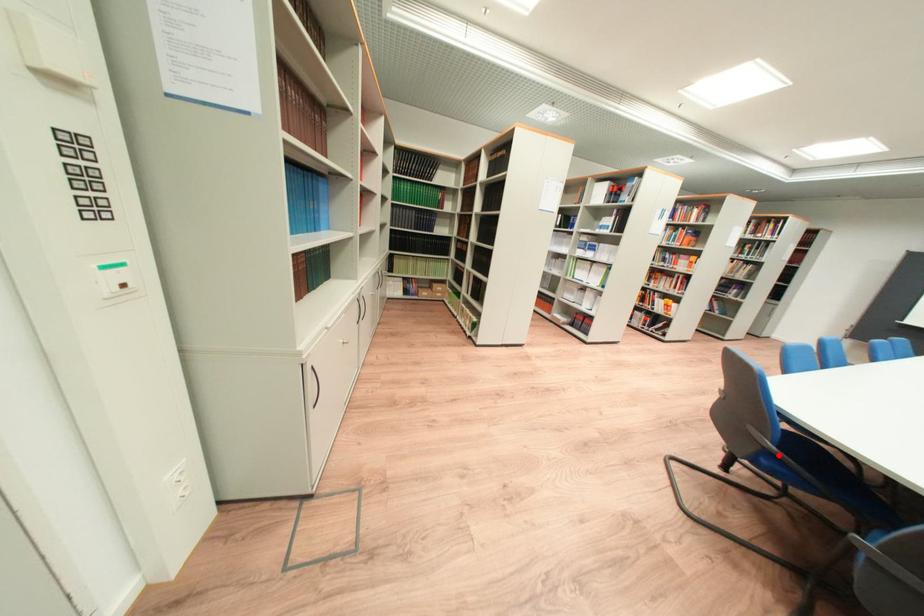
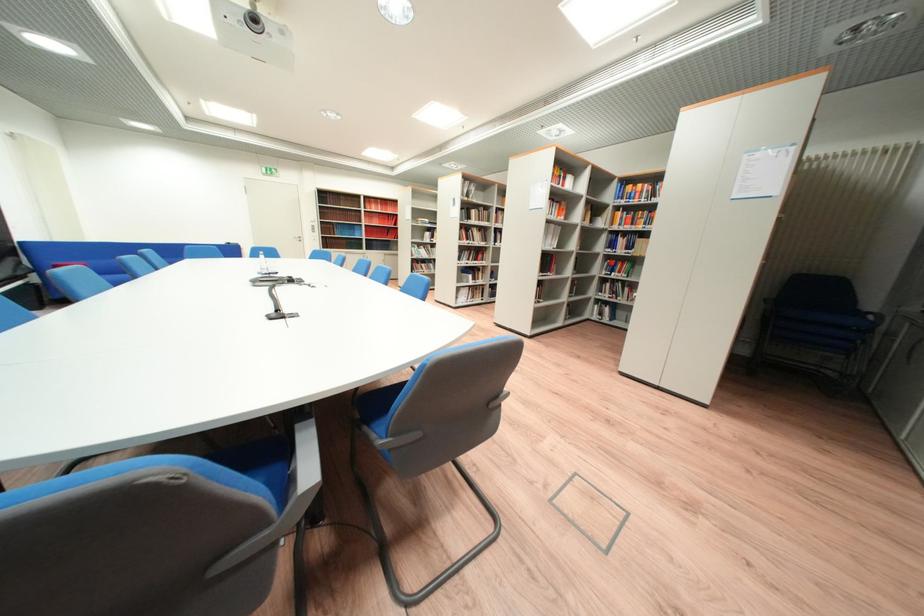
Question: I am providing you with two images of the same scene from different viewpoints. A red point is marked on the first image. At the location where the point appears in image 1, is it still visible in image 2?

Choices:
 (A) Yes
 (B) No

Answer: (B)